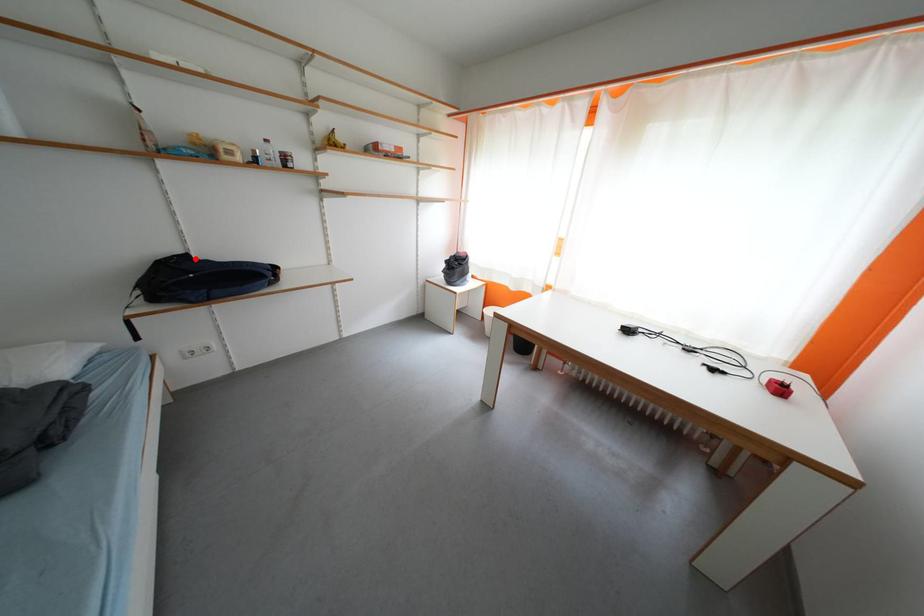
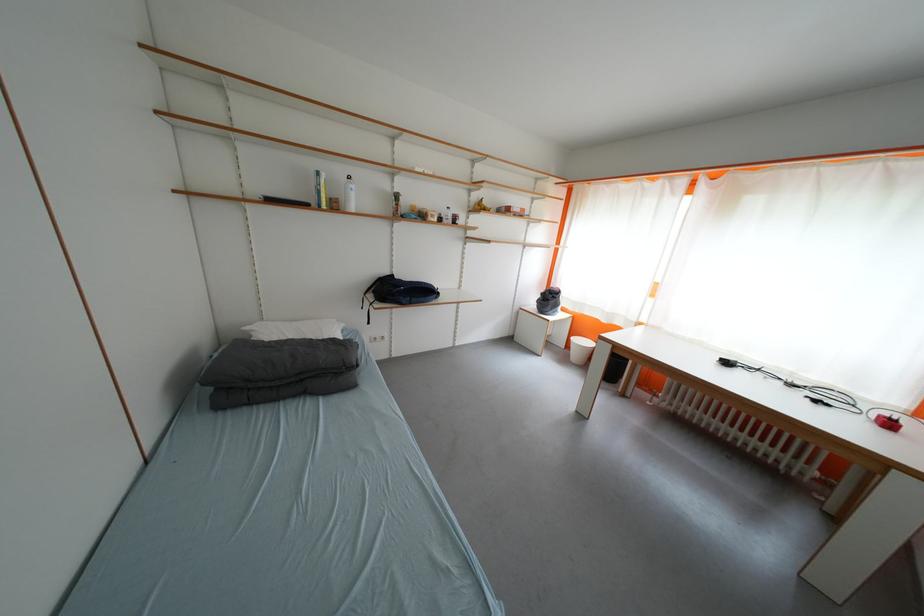
The point at the highlighted location is marked in the first image. Where is the corresponding point in the second image?

(400, 278)